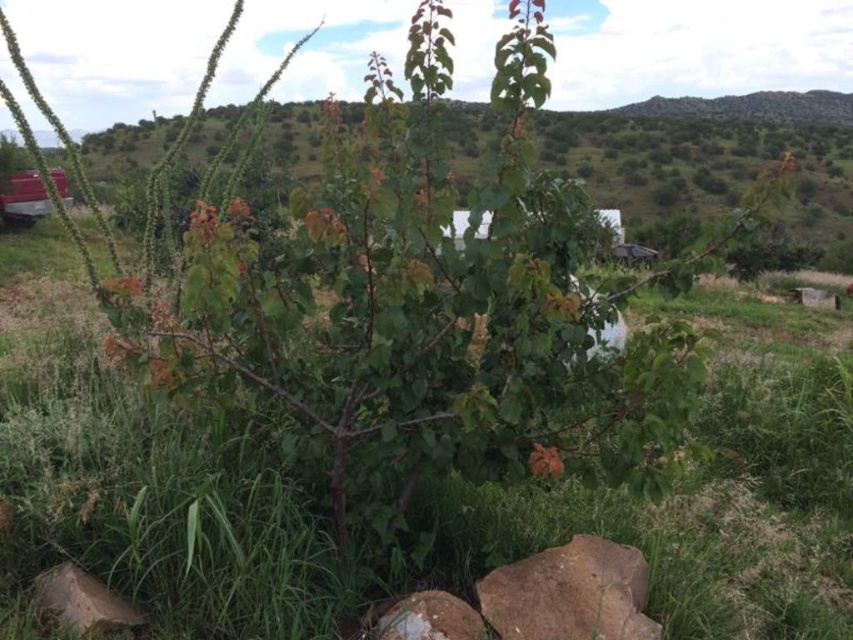
You are standing in the outdoor area and see the brown rough rock at lower center and the metallic red car at left. Which object is positioned more to the right side of the scene?

The brown rough rock at lower center is positioned to the right of the metallic red car at left, so it is more to the right side of the scene.

You are standing at the center of the image and want to move towards the brown rough boulder at lower left. Which direction should you face to walk directly towards it?

The brown rough boulder at lower left is located at point coordinates, so you should face the lower left direction to walk directly towards it.

You are standing in the outdoor scene looking at the tree and the rocks. There are two points marked in the image. Which point, point (x=579, y=536) or point (x=45, y=208), is closer to you?

Point (x=579, y=536) is closer to the camera than point (x=45, y=208).